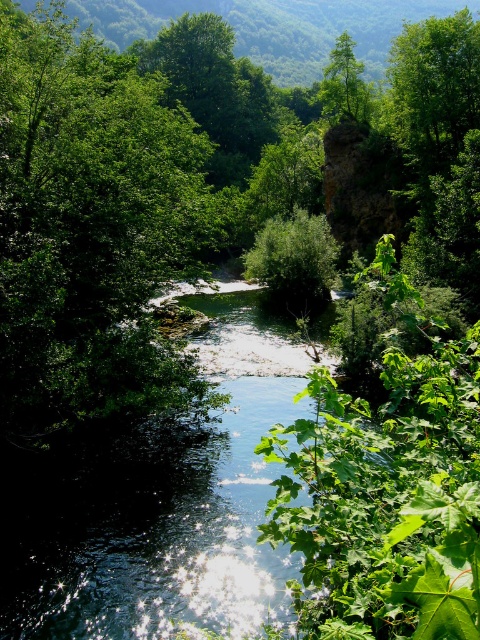
Looking at the serene natural landscape, there is a clear water at center and a green leafy tree at upper center. Which object is located higher in the image?

The green leafy tree at upper center is located higher in the image as it is positioned above the clear water at center.

You are a hiker standing at the edge of the river in the image. You notice the clear water at center and the green leafy tree at upper center. Which one appears taller from your perspective?

The green leafy tree at upper center appears taller than the clear water at center because the clear water at center has a lesser height compared to green leafy tree at upper center.

Looking at this image, you are a photographer planning to capture the entire scene in one shot. Given that your camera can only focus on objects within a 10m width, will the clear water at center and the green leafy tree at upper center both fit within the frame?

The clear water at center has a larger width than the green leafy tree at upper center. Since the camera can focus on objects within a 10m width, both objects will fit within the frame as long as their combined widths do not exceed 10m. However, without knowing the exact widths of each object, it is impossible to determine definitively.